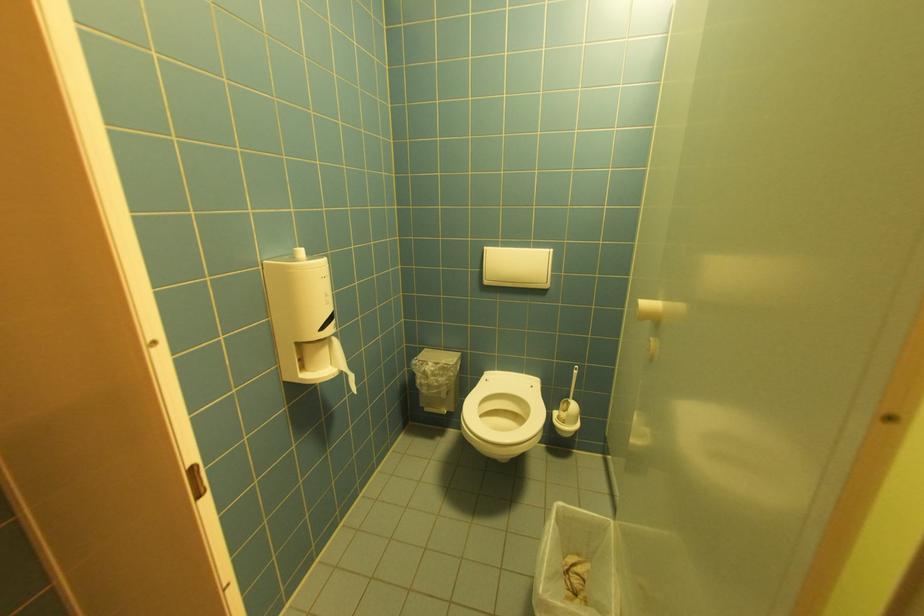
Where would you pull the roll of toilet paper? Please return your answer as a coordinate pair (x, y).

(660, 310)